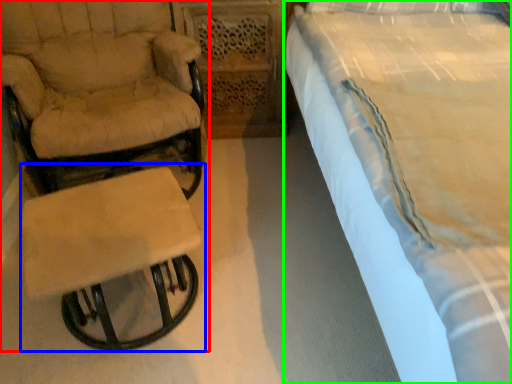
Question: Which object is the farthest from chair (highlighted by a red box)? Choose among these: table (highlighted by a blue box) or bed (highlighted by a green box).

Choices:
 (A) table
 (B) bed

Answer: (B)